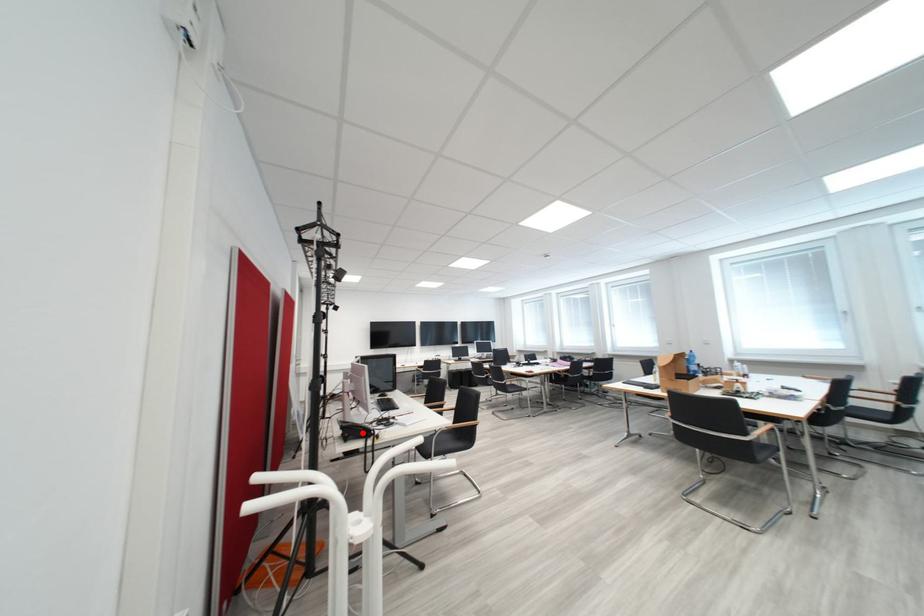
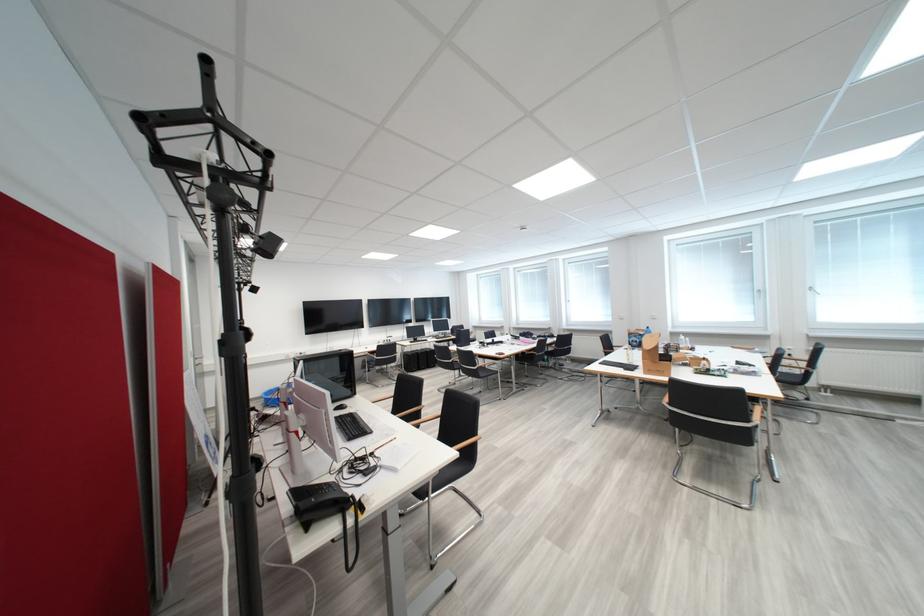
Locate, in the second image, the point that corresponds to the highlighted location in the first image.

(325, 507)